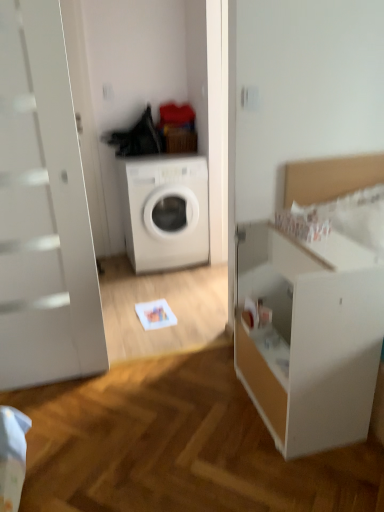
The height and width of the screenshot is (512, 384). Describe the element at coordinates (164, 211) in the screenshot. I see `white matte washing machine at center` at that location.

Where is `white matte washing machine at center`? white matte washing machine at center is located at coordinates (164, 211).

At what (x,y) coordinates should I click in order to perform the action: click on white matte dresser at right. Please return your answer as a coordinate pair (x, y). Looking at the image, I should click on (310, 336).

What do you see at coordinates (310, 336) in the screenshot? I see `white matte dresser at right` at bounding box center [310, 336].

The width and height of the screenshot is (384, 512). In order to click on white matte washing machine at center in this screenshot , I will do `click(164, 211)`.

Considering the relative positions of white matte dresser at right and white matte washing machine at center in the image provided, is white matte dresser at right to the right of white matte washing machine at center from the viewer's perspective?

Correct, you'll find white matte dresser at right to the right of white matte washing machine at center.

Is white matte dresser at right behind white matte washing machine at center?

No, the depth of white matte dresser at right is less than that of white matte washing machine at center.

Does point (295, 430) lie in front of point (158, 252)?

Yes, point (295, 430) is closer to viewer.

From the image's perspective, would you say white matte dresser at right is shown under white matte washing machine at center?

Yes, from the image's perspective, white matte dresser at right is below white matte washing machine at center.

From a real-world perspective, between white matte dresser at right and white matte washing machine at center, who is vertically higher?

white matte washing machine at center, from a real-world perspective.

Considering the relative sizes of white matte dresser at right and white matte washing machine at center in the image provided, is white matte dresser at right thinner than white matte washing machine at center?

Correct, the width of white matte dresser at right is less than that of white matte washing machine at center.

Considering the relative sizes of white matte dresser at right and white matte washing machine at center in the image provided, is white matte dresser at right taller than white matte washing machine at center?

Incorrect, the height of white matte dresser at right is not larger of that of white matte washing machine at center.

In terms of size, does white matte dresser at right appear bigger or smaller than white matte washing machine at center?

white matte dresser at right is smaller than white matte washing machine at center.

Is white matte dresser at right not inside white matte washing machine at center?

Yes.

Are white matte dresser at right and white matte washing machine at center located far from each other?

Absolutely, white matte dresser at right is distant from white matte washing machine at center.

Based on the photo, is white matte dresser at right facing towards white matte washing machine at center?

No.

Based on the photo, how different are the orientations of white matte dresser at right and white matte washing machine at center in degrees?

91.6 degrees separate the facing orientations of white matte dresser at right and white matte washing machine at center.

Measure the distance between white matte dresser at right and white matte washing machine at center.

The distance of white matte dresser at right from white matte washing machine at center is 1.44 meters.

I want to click on washing machine behind the white matte dresser at right, so click(x=164, y=211).

Is white matte washing machine at center to the left or to the right of white matte dresser at right in the image?

Clearly, white matte washing machine at center is on the left of white matte dresser at right in the image.

Considering the positions of objects white matte washing machine at center and white matte dresser at right in the image provided, who is behind, white matte washing machine at center or white matte dresser at right?

white matte washing machine at center.

Is point (175, 231) closer or farther from the camera than point (274, 293)?

Point (175, 231).

From the image's perspective, would you say white matte washing machine at center is positioned over white matte dresser at right?

Yes, from the image's perspective, white matte washing machine at center is on top of white matte dresser at right.

From a real-world perspective, is white matte washing machine at center positioned under white matte dresser at right based on gravity?

No, from a real-world perspective, white matte washing machine at center is not under white matte dresser at right.

Does white matte washing machine at center have a greater width compared to white matte dresser at right?

Yes.

Considering the sizes of objects white matte washing machine at center and white matte dresser at right in the image provided, who is taller, white matte washing machine at center or white matte dresser at right?

white matte washing machine at center is taller.

Does white matte washing machine at center have a smaller size compared to white matte dresser at right?

Incorrect, white matte washing machine at center is not smaller in size than white matte dresser at right.

Is white matte dresser at right completely or partially inside white matte washing machine at center?

No.

Would you consider white matte washing machine at center to be distant from white matte dresser at right?

Yes.

Could you tell me if white matte washing machine at center is facing white matte dresser at right?

Yes, white matte washing machine at center is oriented towards white matte dresser at right.

Find the location of `dresser that is on the right side of white matte washing machine at center`. dresser that is on the right side of white matte washing machine at center is located at coordinates (310, 336).

In the image, there is a white matte dresser at right. Identify the location of washing machine above it (from the image's perspective). The height and width of the screenshot is (512, 384). (164, 211).

You are a GUI agent. You are given a task and a screenshot of the screen. Output one action in this format:
    pyautogui.click(x=<x>, y=<y>)
    Task: Click on the washing machine behind the white matte dresser at right
    
    Given the screenshot: What is the action you would take?
    pyautogui.click(x=164, y=211)